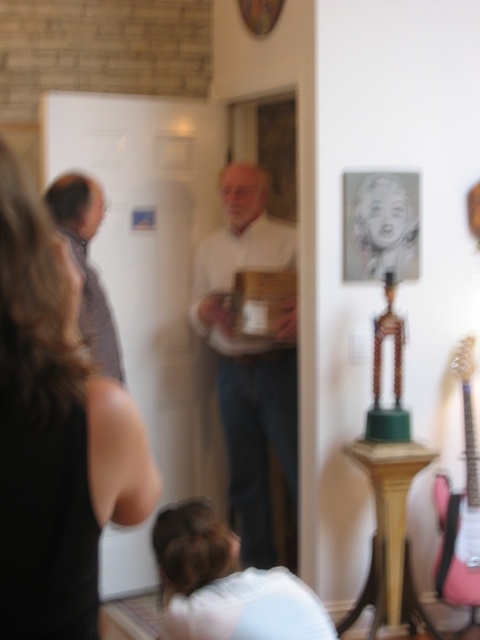
Question: Observing the image, what is the correct spatial positioning of white matte shirt at center in reference to wooden pedestal at center?

Choices:
 (A) below
 (B) above

Answer: (B)

Question: Which object is farther from the camera taking this photo?

Choices:
 (A) white matte shirt at center
 (B) smooth black dress at lower left
 (C) pink glossy guitar at right

Answer: (A)

Question: Is white matte shirt at center to the right of pink glossy guitar at right from the viewer's perspective?

Choices:
 (A) no
 (B) yes

Answer: (A)

Question: Estimate the real-world distances between objects in this image. Which object is closer to the pink glossy guitar at right?

Choices:
 (A) white soft fabric at lower center
 (B) white matte shirt at center

Answer: (B)

Question: Which point appears closest to the camera in this image?

Choices:
 (A) (460, 349)
 (B) (403, 493)
 (C) (82, 381)

Answer: (C)

Question: Is wooden pedestal at center thinner than matte gray shirt at left?

Choices:
 (A) no
 (B) yes

Answer: (A)